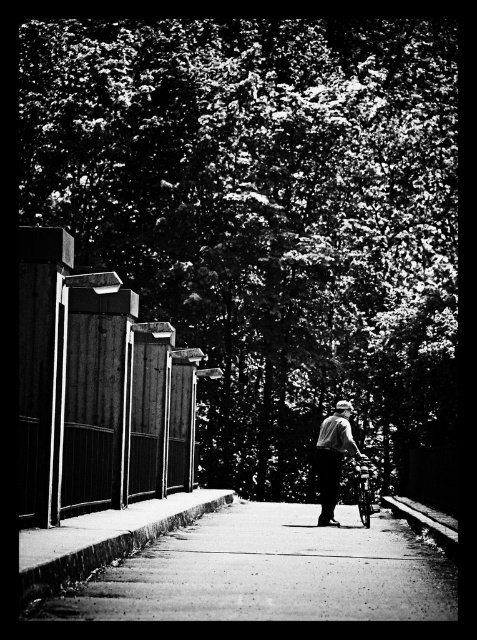
Question: Is the position of dark green foliage at upper center less distant than that of smooth gray shirt at center?

Choices:
 (A) yes
 (B) no

Answer: (B)

Question: Which object is positioned farthest from the smooth gray shirt at center?

Choices:
 (A) dark green foliage at upper center
 (B) smooth concrete pavement at center

Answer: (A)

Question: Which point is closer to the camera?

Choices:
 (A) smooth gray shirt at center
 (B) dark green foliage at upper center
 (C) smooth concrete pavement at center

Answer: (C)

Question: Which point appears farthest from the camera in this image?

Choices:
 (A) (354, 442)
 (B) (189, 540)

Answer: (A)

Question: Is dark green foliage at upper center to the left of smooth gray shirt at center from the viewer's perspective?

Choices:
 (A) yes
 (B) no

Answer: (A)

Question: Is dark green foliage at upper center above smooth concrete pavement at center?

Choices:
 (A) no
 (B) yes

Answer: (B)